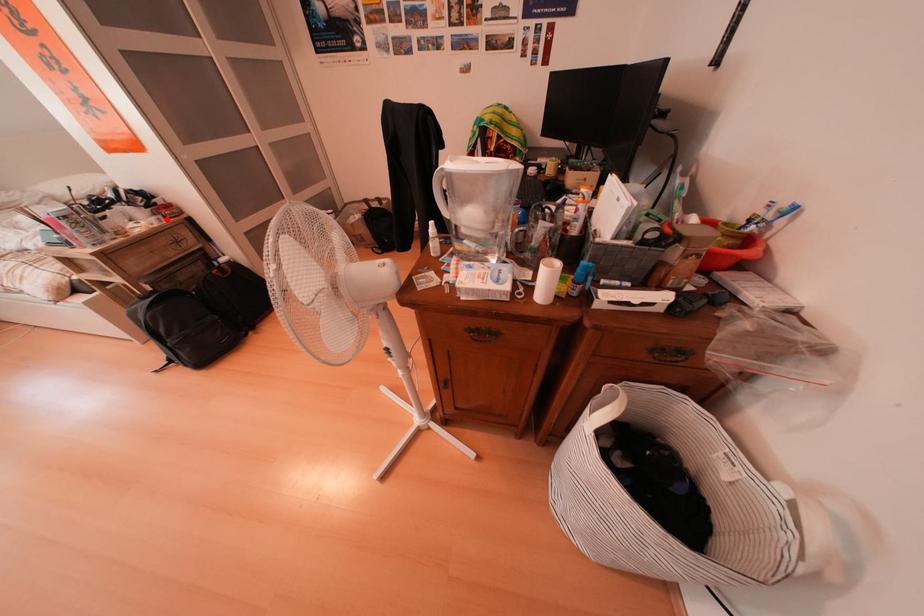
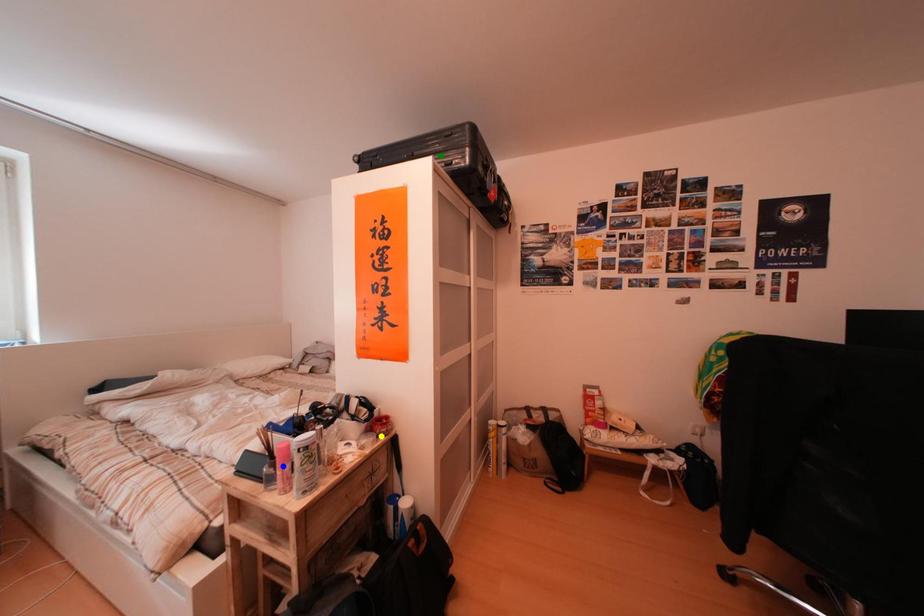
Question: I am providing you with two images of the same scene from different viewpoints. A red point is marked on the first image. You are given multiple points on the second image. Which spot in image 2 lines up with the point in image 1?

Choices:
 (A) yellow point
 (B) blue point
 (C) green point

Answer: (A)